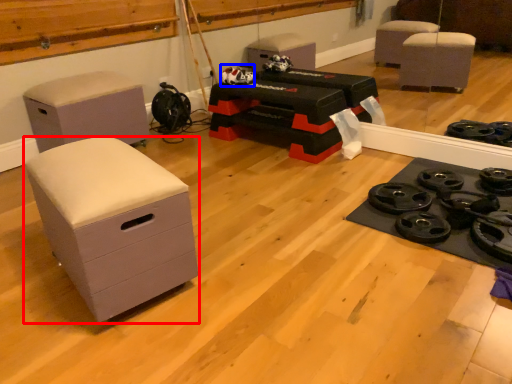
Question: Which point is closer to the camera, chest of drawers (highlighted by a red box) or toy (highlighted by a blue box)?

Choices:
 (A) chest of drawers
 (B) toy

Answer: (A)